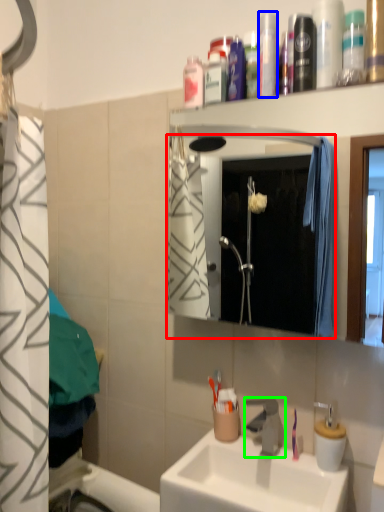
Question: Estimate the real-world distances between objects in this image. Which object is farther from mirror (highlighted by a red box), mouthwash (highlighted by a blue box) or tap (highlighted by a green box)?

Choices:
 (A) mouthwash
 (B) tap

Answer: (A)